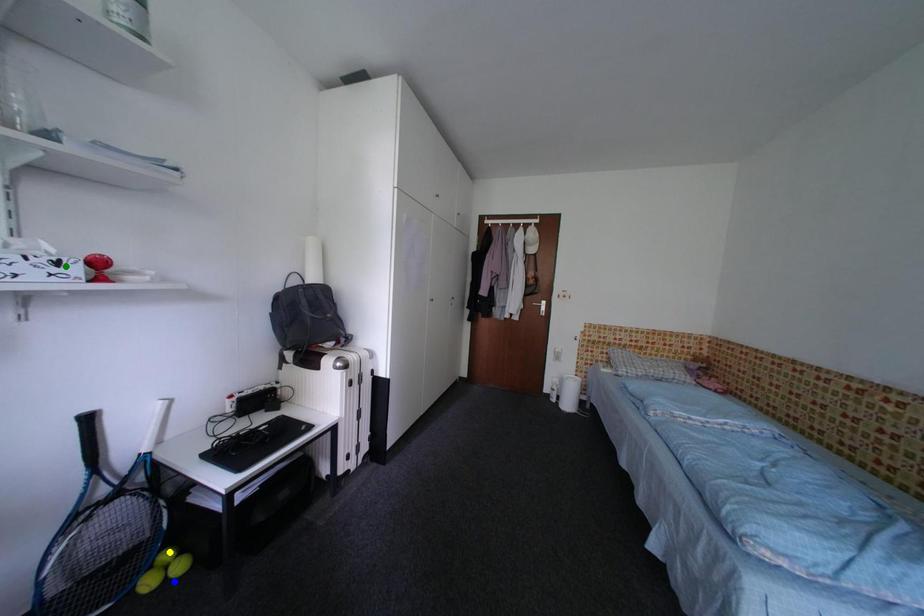
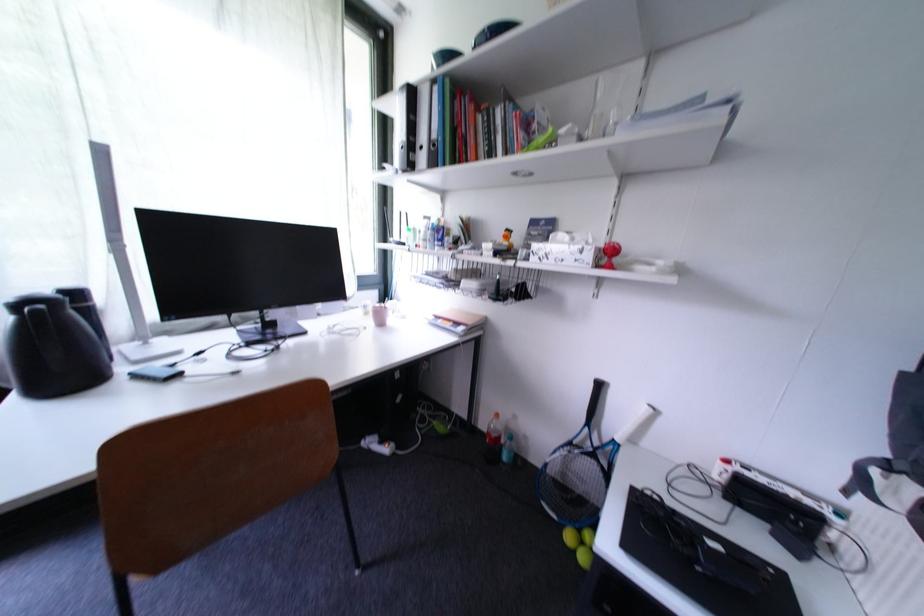
I am providing you with two images of the same scene from different viewpoints. Three points are marked in image1. Which point corresponds to a part or object that is occluded in image2?In image1, three points are marked. Which of them correspond to a part or object that is occluded in image2?Among the three points shown in image1, which one corresponds to a part or object that is no longer visible due to occlusion in image2?

yellow point